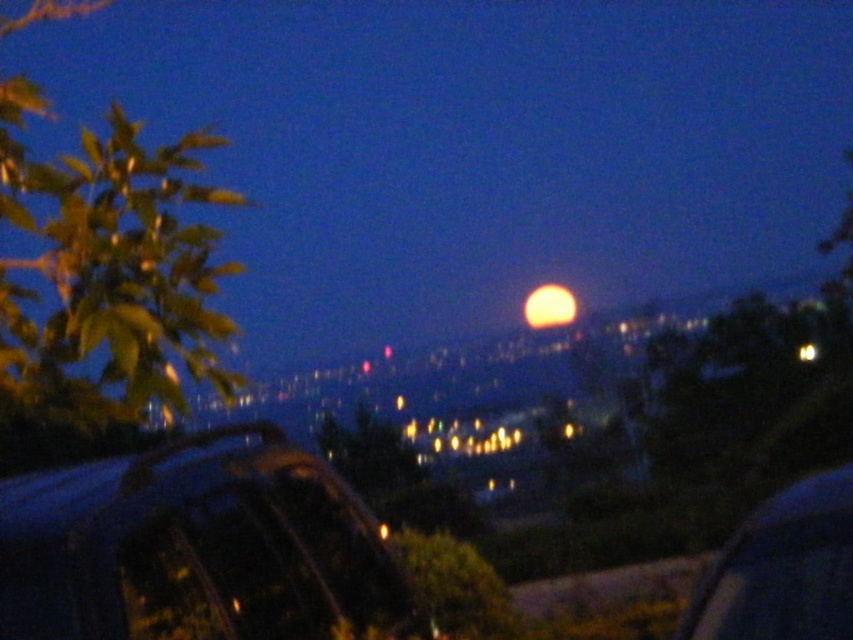
Can you confirm if shiny black car at lower left is smaller than green leafy tree at left?

Yes.

Between shiny black car at lower left and green leafy tree at left, which one appears on the right side from the viewer's perspective?

shiny black car at lower left is more to the right.

The image size is (853, 640). Identify the location of shiny black car at lower left. (196, 547).

Where is `shiny black car at lower left`? The height and width of the screenshot is (640, 853). shiny black car at lower left is located at coordinates (196, 547).

Based on the photo, can you confirm if metallic blue car at lower right is thinner than green leafy tree at center?

Yes, metallic blue car at lower right is thinner than green leafy tree at center.

What do you see at coordinates (782, 570) in the screenshot? This screenshot has width=853, height=640. I see `metallic blue car at lower right` at bounding box center [782, 570].

Is point (692, 636) positioned in front of point (418, 534)?

Yes, point (692, 636) is in front of point (418, 534).

Identify the location of metallic blue car at lower right. The width and height of the screenshot is (853, 640). (782, 570).

From the picture: Measure the distance between point (x=39, y=257) and camera.

The distance of point (x=39, y=257) from camera is 4.02 meters.

Find the location of a particular element. green leafy tree at left is located at coordinates (108, 273).